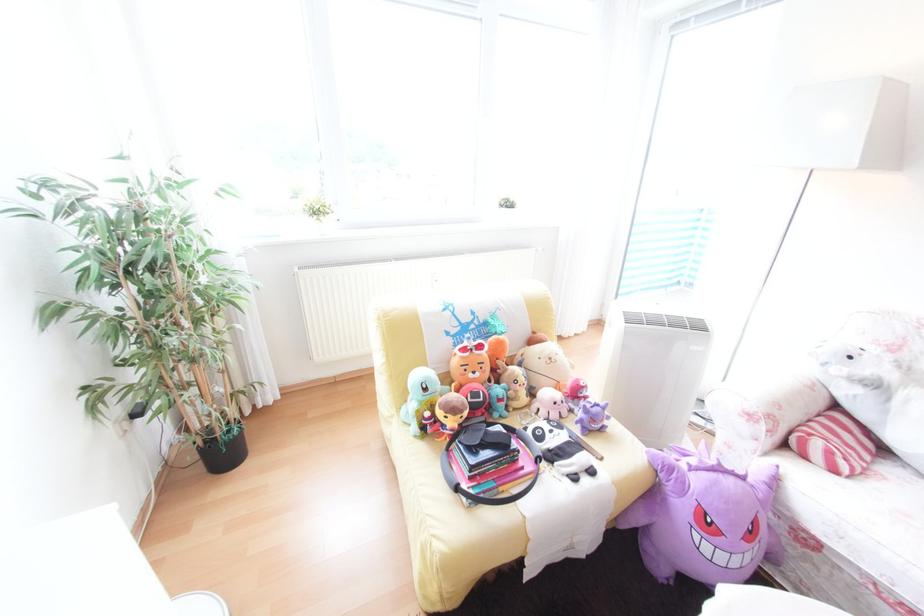
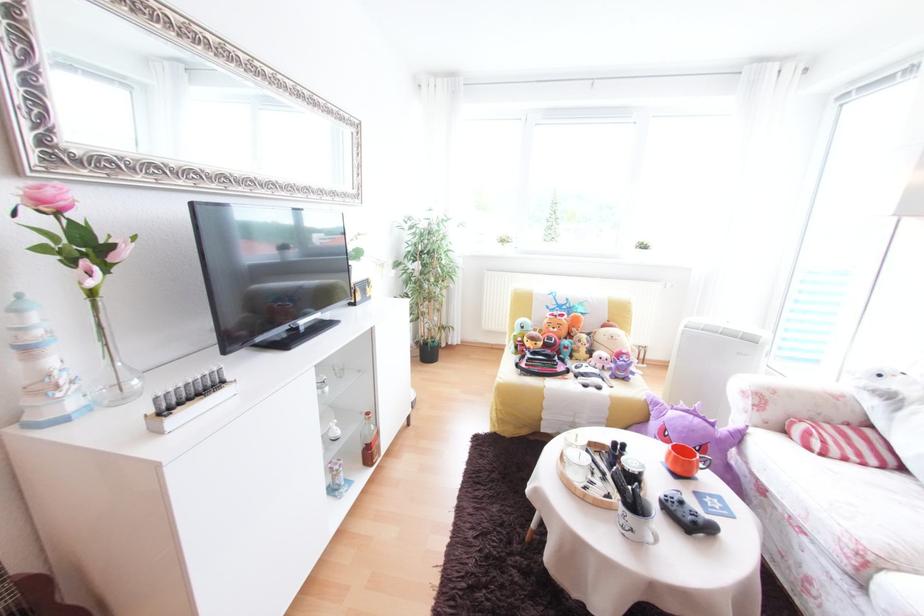
The point at (760, 524) is marked in the first image. Where is the corresponding point in the second image?

(709, 447)